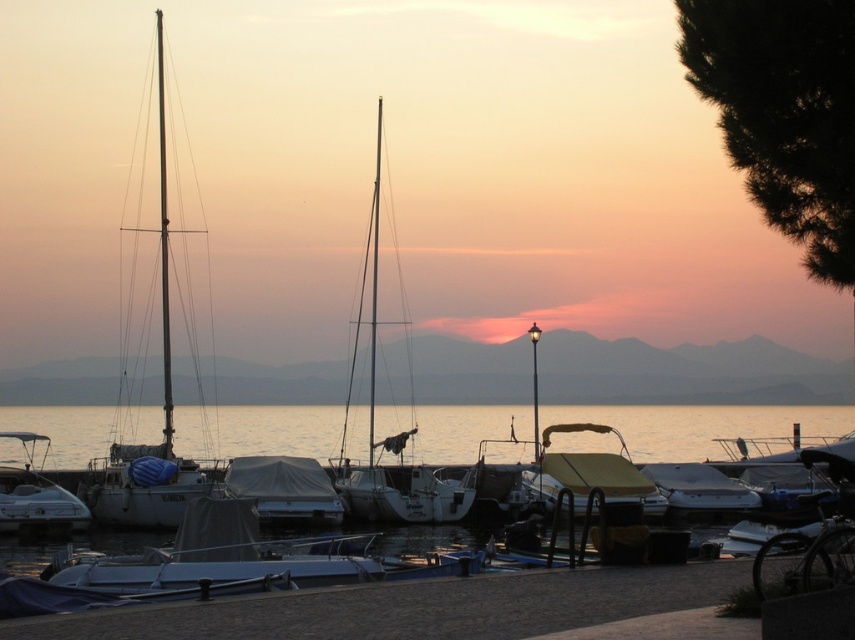
Which is below, white matte sailboat at center or white tarpaulin boat at center?

Positioned lower is white tarpaulin boat at center.

Which is more to the left, white matte sailboat at center or white tarpaulin boat at center?

From the viewer's perspective, white matte sailboat at center appears more on the left side.

What do you see at coordinates (394, 435) in the screenshot? I see `white matte sailboat at center` at bounding box center [394, 435].

Locate an element on the screen. The width and height of the screenshot is (855, 640). white matte sailboat at center is located at coordinates (394, 435).

Which is more to the left, yellow matte boat at center or white glossy boat at left?

white glossy boat at left is more to the left.

Is yellow matte boat at center taller than white glossy boat at left?

Yes, yellow matte boat at center is taller than white glossy boat at left.

Is point (594, 460) positioned in front of point (31, 486)?

That is False.

The height and width of the screenshot is (640, 855). Find the location of `yellow matte boat at center`. yellow matte boat at center is located at coordinates (590, 474).

Which of these two, white tarpaulin boat at center or white matte boat at center, stands taller?

white tarpaulin boat at center is taller.

Which is in front, point (263, 496) or point (712, 502)?

Point (263, 496) is in front.

Where is `white tarpaulin boat at center`? white tarpaulin boat at center is located at coordinates (286, 490).